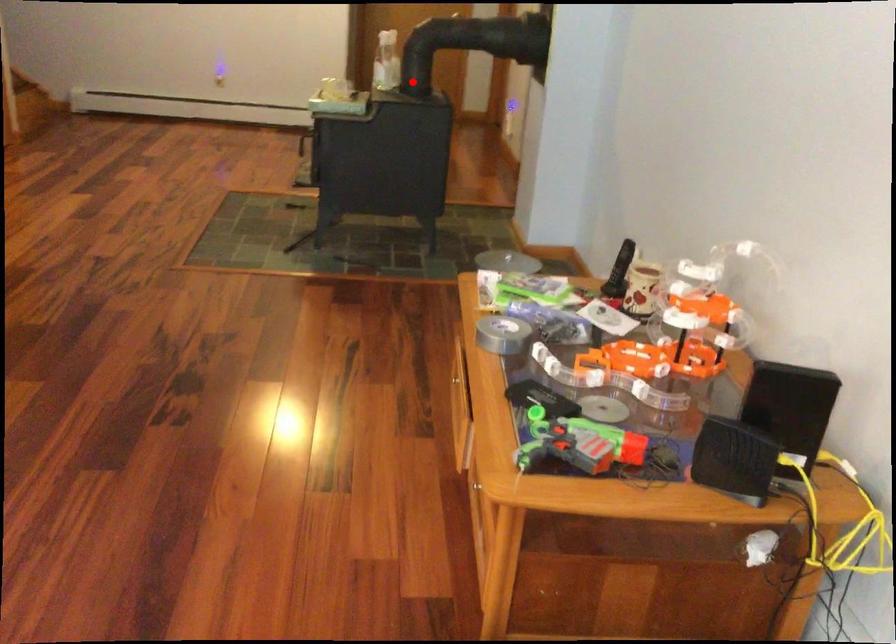
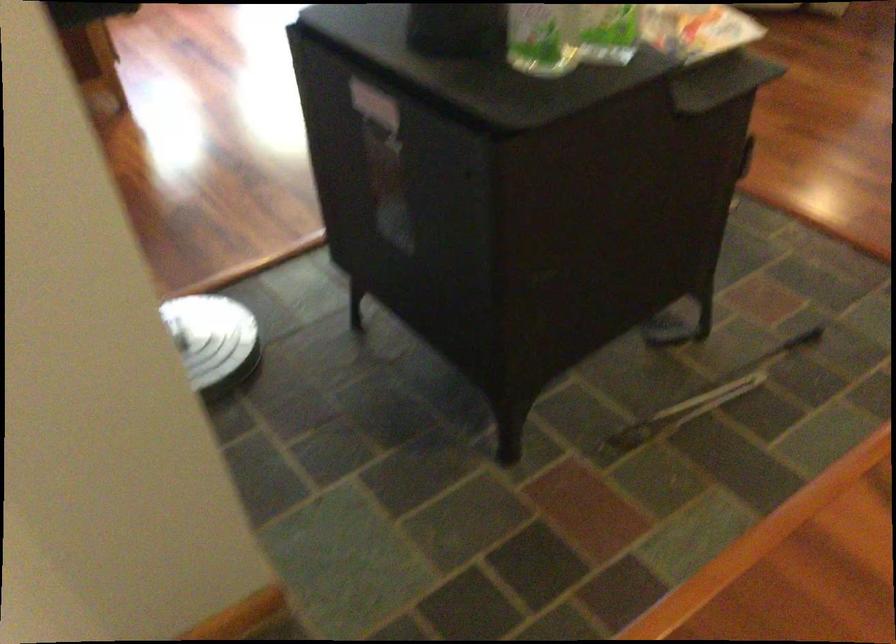
Question: I am providing you with two images of the same scene from different viewpoints. In image1, a red point is highlighted. Considering the same 3D point in image2, which of the following is correct?

Choices:
 (A) It is closer
 (B) It is farther

Answer: (A)